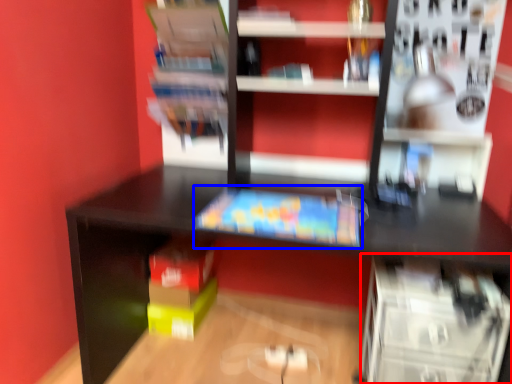
Question: Among these objects, which one is farthest to the camera, shelf (highlighted by a red box) or book (highlighted by a blue box)?

Choices:
 (A) shelf
 (B) book

Answer: (B)